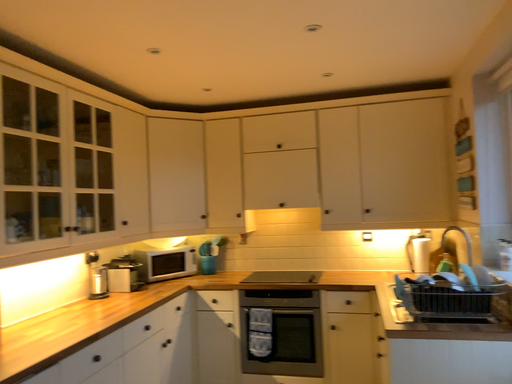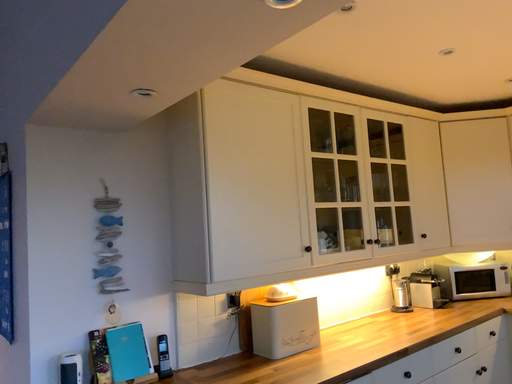
Question: Which way did the camera rotate in the video?

Choices:
 (A) rotated left
 (B) rotated right

Answer: (A)